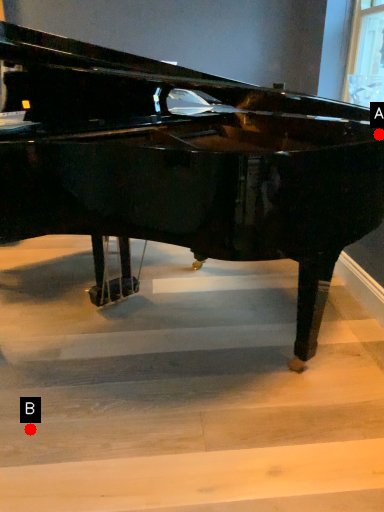
Question: Two points are circled on the image, labeled by A and B beside each circle. Among these points, which one is nearest to the camera?

Choices:
 (A) A is closer
 (B) B is closer

Answer: (B)